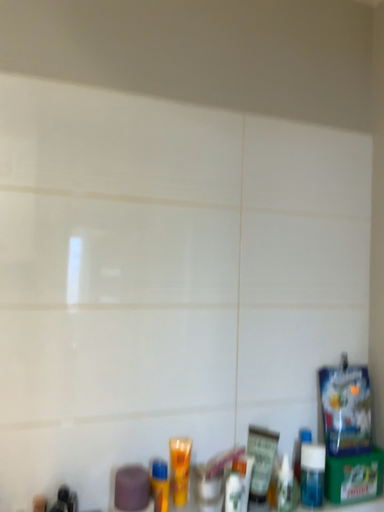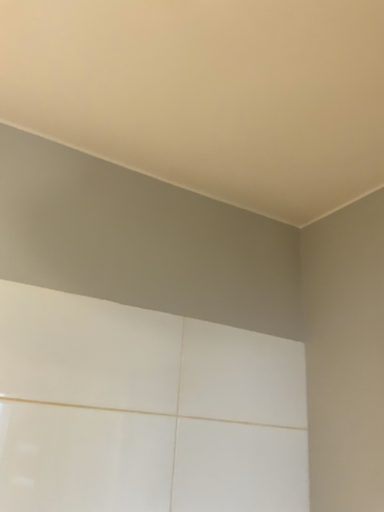
Question: Which way did the camera rotate in the video?

Choices:
 (A) rotated left
 (B) rotated right

Answer: (B)